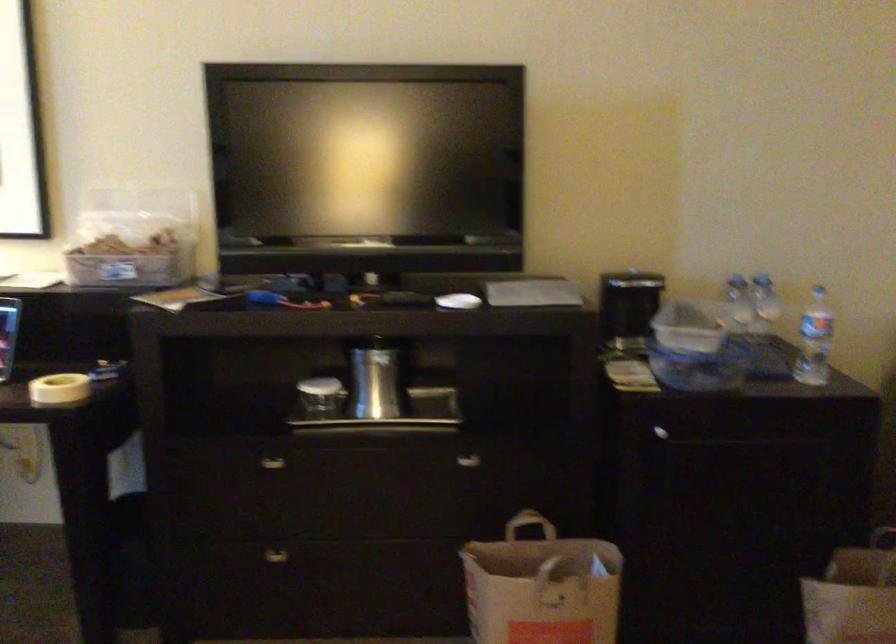
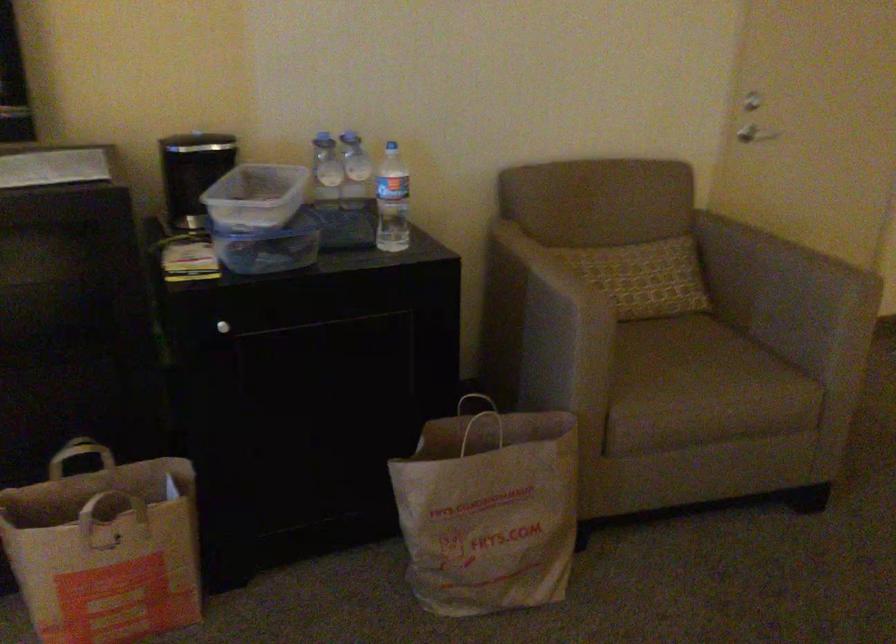
Locate, in the second image, the point that corresponds to point 685,323 in the first image.

(255, 196)